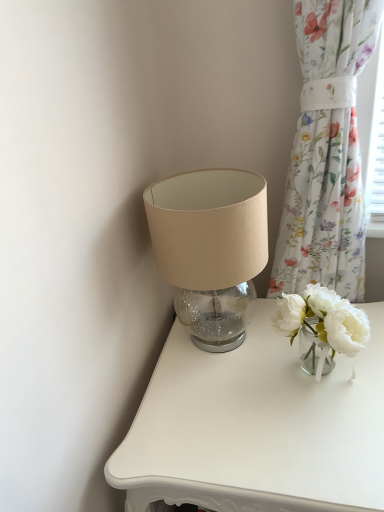
Question: In terms of width, does floral fabric curtain at right look wider or thinner when compared to white matte vase at right?

Choices:
 (A) thin
 (B) wide

Answer: (A)

Question: Would you say floral fabric curtain at right is inside or outside white matte vase at right?

Choices:
 (A) outside
 (B) inside

Answer: (A)

Question: Considering the positions of floral fabric curtain at right and white matte vase at right in the image, is floral fabric curtain at right bigger or smaller than white matte vase at right?

Choices:
 (A) big
 (B) small

Answer: (A)

Question: Would you say white matte vase at right is to the left or to the right of floral fabric curtain at right in the picture?

Choices:
 (A) left
 (B) right

Answer: (A)

Question: Relative to floral fabric curtain at right, is white matte vase at right in front or behind?

Choices:
 (A) behind
 (B) front

Answer: (A)

Question: Looking at their shapes, would you say white matte vase at right is wider or thinner than floral fabric curtain at right?

Choices:
 (A) thin
 (B) wide

Answer: (B)

Question: Is point (301, 309) positioned closer to the camera than point (355, 292)?

Choices:
 (A) closer
 (B) farther

Answer: (A)